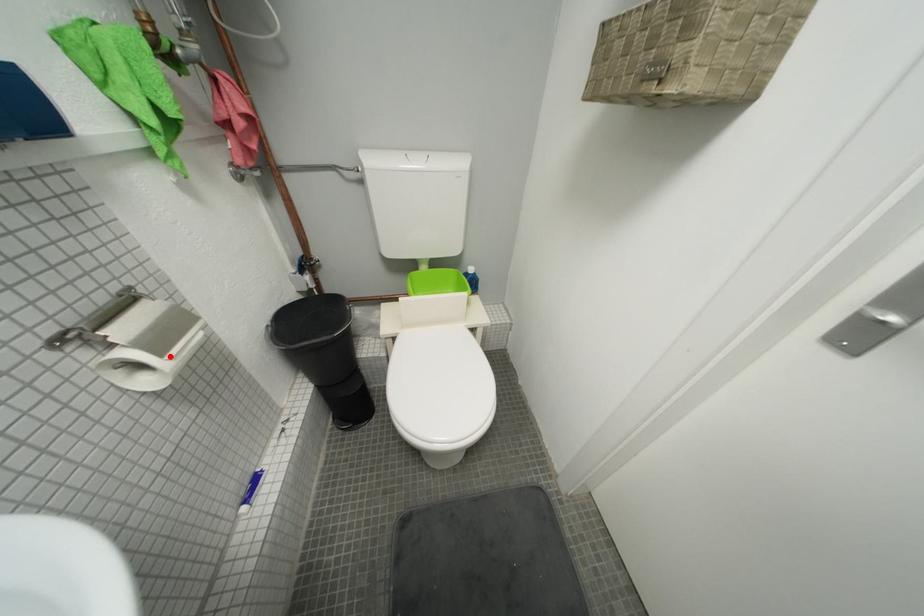
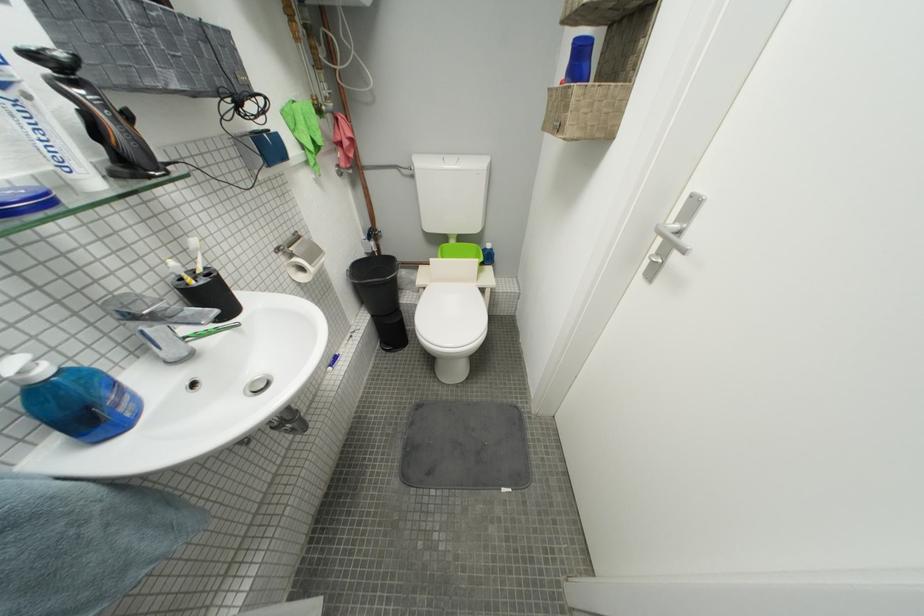
Locate, in the second image, the point that corresponds to the highlighted location in the first image.

(320, 265)